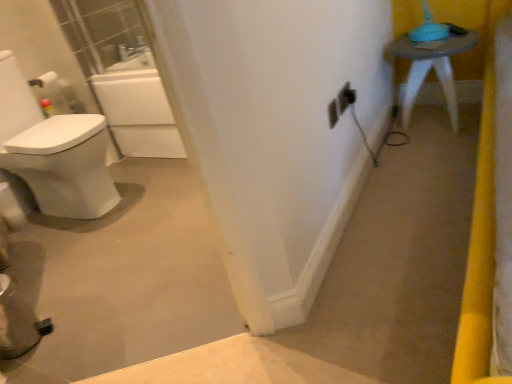
Question: Does point (436, 44) appear closer or farther from the camera than point (330, 114)?

Choices:
 (A) farther
 (B) closer

Answer: (A)

Question: Choose the correct answer: Is matte gray stool at upper right inside white plastic electric outlet at center, marked as the first electric outlet in a left-to-right arrangement, or outside it?

Choices:
 (A) inside
 (B) outside

Answer: (B)

Question: Which object is the farthest from the black plastic outlet at center, the 2th electric outlet when ordered from right to left?

Choices:
 (A) white plastic electric outlet at center, marked as the first electric outlet in a left-to-right arrangement
 (B) matte black outlet at center-right, placed as the 1th electric outlet when sorted from right to left
 (C) matte gray stool at upper right

Answer: (C)

Question: Which of these objects is positioned farthest from the black plastic outlet at center, the 2th electric outlet when ordered from right to left?

Choices:
 (A) matte black outlet at center-right, placed as the 1th electric outlet when sorted from right to left
 (B) matte gray stool at upper right
 (C) white plastic electric outlet at center, marked as the first electric outlet in a left-to-right arrangement

Answer: (B)